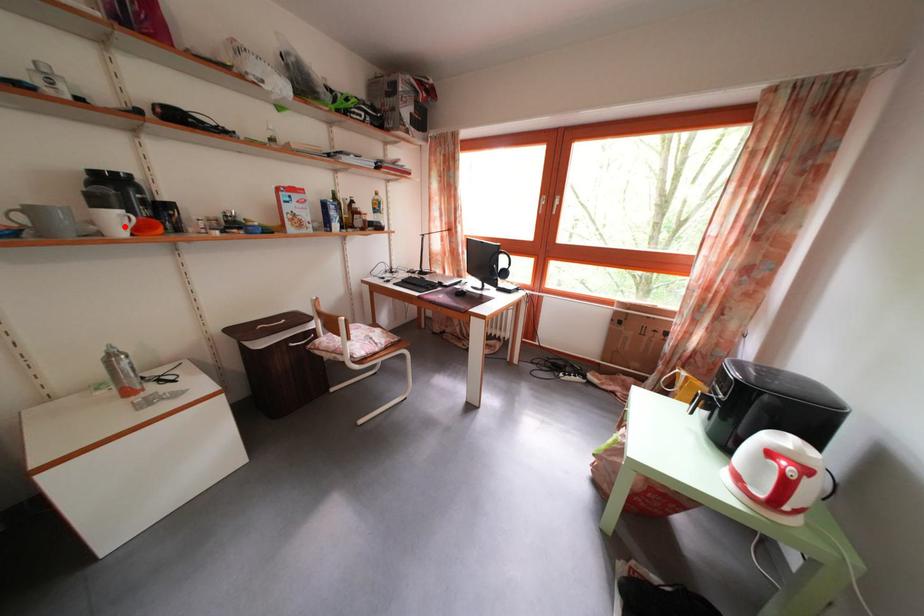
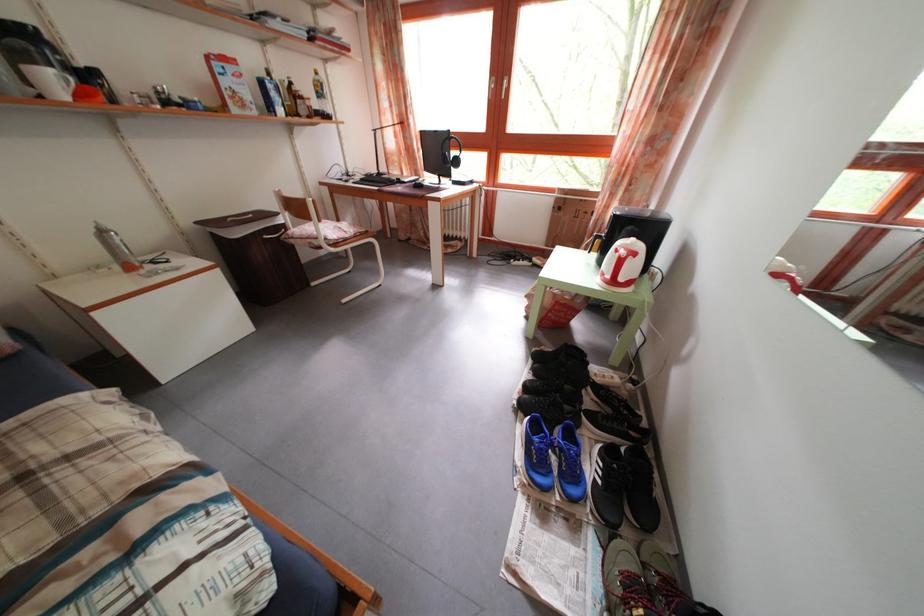
In the second image, find the point that corresponds to the highlighted location in the first image.

(58, 87)